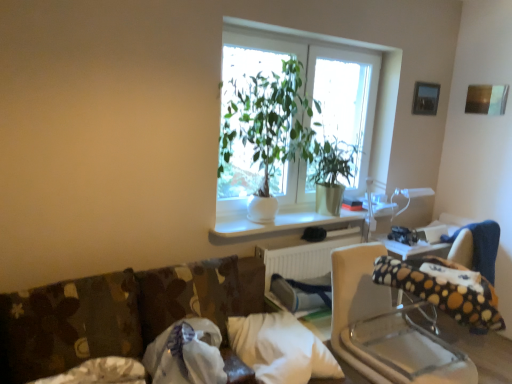
Describe the element at coordinates (444, 290) in the screenshot. I see `polka dot fabric bean bag chair at right` at that location.

Describe the element at coordinates (279, 222) in the screenshot. I see `white matte window sill at center` at that location.

Locate an element on the screen. white soft pillow at lower center, the 3th pillow viewed from the left is located at coordinates (280, 349).

The image size is (512, 384). Describe the element at coordinates (186, 354) in the screenshot. I see `white fabric pillow at lower left, which is the 2th pillow in left-to-right order` at that location.

What do you see at coordinates (385, 328) in the screenshot? I see `polka dot fabric rocking chair at center` at bounding box center [385, 328].

This screenshot has height=384, width=512. I want to click on polka dot fabric bean bag chair at right, so click(444, 290).

Between white fabric pillow at lower left, the second pillow when ordered from right to left, and metallic silver picture frame at upper right, which one appears on the right side from the viewer's perspective?

metallic silver picture frame at upper right is more to the right.

Does white fabric pillow at lower left, which is the 2th pillow in left-to-right order, have a lesser height compared to metallic silver picture frame at upper right?

Yes, white fabric pillow at lower left, which is the 2th pillow in left-to-right order, is shorter than metallic silver picture frame at upper right.

Which pillow is the 2nd one when counting from the left side of the metallic silver picture frame at upper right? Please provide its 2D coordinates.

[(186, 354)]

Is white fabric pillow at lower left, the second pillow when ordered from right to left, positioned with its back to metallic silver picture frame at upper right?

No, white fabric pillow at lower left, the second pillow when ordered from right to left,'s orientation is not away from metallic silver picture frame at upper right.

Considering the relative sizes of white matte window sill at center and polka dot fabric bean bag chair at right in the image provided, is white matte window sill at center wider than polka dot fabric bean bag chair at right?

No.

The width and height of the screenshot is (512, 384). I want to click on bean bag chair that is in front of the white matte window sill at center, so click(x=444, y=290).

From a real-world perspective, is white matte window sill at center positioned over polka dot fabric bean bag chair at right based on gravity?

Yes.

Is point (315, 215) closer or farther from the camera than point (424, 291)?

Point (315, 215) is positioned farther from the camera compared to point (424, 291).

Is white matte radiator at center oriented away from white soft pillow at lower center, the 3th pillow viewed from the left?

No.

Considering the sizes of objects white matte radiator at center and white soft pillow at lower center, the 3th pillow viewed from the left, in the image provided, who is thinner, white matte radiator at center or white soft pillow at lower center, the 3th pillow viewed from the left,?

With smaller width is white matte radiator at center.

Looking at the image, does white matte radiator at center seem bigger or smaller compared to white soft pillow at lower center, which appears as the 1th pillow when viewed from the right?

In the image, white matte radiator at center appears to be larger than white soft pillow at lower center, which appears as the 1th pillow when viewed from the right.

Find the location of a particular element. This screenshot has height=384, width=512. radiator lying above the white soft pillow at lower center, which appears as the 1th pillow when viewed from the right (from the image's perspective) is located at coordinates (302, 267).

Based on the photo, is polka dot fabric rocking chair at center positioned before white fabric pillow at lower left, the second pillow when ordered from right to left?

No.

Considering the relative sizes of polka dot fabric rocking chair at center and white fabric pillow at lower left, which is the 2th pillow in left-to-right order, in the image provided, is polka dot fabric rocking chair at center taller than white fabric pillow at lower left, which is the 2th pillow in left-to-right order,?

Yes.

At what (x,y) coordinates should I click in order to perform the action: click on rocking chair above the white fabric pillow at lower left, which is the 2th pillow in left-to-right order (from a real-world perspective). Please return your answer as a coordinate pair (x, y). The width and height of the screenshot is (512, 384). Looking at the image, I should click on (385, 328).

Who is taller, brown floral fabric pillow at lower left, placed as the 3th pillow when sorted from right to left, or polka dot fabric bean bag chair at right?

brown floral fabric pillow at lower left, placed as the 3th pillow when sorted from right to left, is taller.

From a real-world perspective, is brown floral fabric pillow at lower left, arranged as the first pillow when viewed from the left, above or below polka dot fabric bean bag chair at right?

brown floral fabric pillow at lower left, arranged as the first pillow when viewed from the left, is below polka dot fabric bean bag chair at right.

Does point (9, 317) lie behind point (477, 281)?

No.

Measure the distance between brown floral fabric pillow at lower left, arranged as the first pillow when viewed from the left, and polka dot fabric bean bag chair at right.

A distance of 1.30 meters exists between brown floral fabric pillow at lower left, arranged as the first pillow when viewed from the left, and polka dot fabric bean bag chair at right.

Considering their positions, is green glossy plant at center located in front of or behind metallic silver picture frame at upper right?

green glossy plant at center is in front of metallic silver picture frame at upper right.

Is green glossy plant at center completely or partially outside of metallic silver picture frame at upper right?

Indeed, green glossy plant at center is completely outside metallic silver picture frame at upper right.

Could you tell me if green glossy plant at center is turned towards metallic silver picture frame at upper right?

No, green glossy plant at center is not oriented towards metallic silver picture frame at upper right.

Looking at the image, does green glossy plant at center seem bigger or smaller compared to metallic silver picture frame at upper right?

In the image, green glossy plant at center appears to be larger than metallic silver picture frame at upper right.

I want to click on plant located behind the green glossy plant at center, so click(x=333, y=161).

In the scene shown: From a real-world perspective, who is located lower, green matte plant at center or green glossy plant at center?

green matte plant at center is physically lower.

Can you confirm if green matte plant at center is taller than green glossy plant at center?

No.

From the image's perspective, is green matte plant at center positioned above or below green glossy plant at center?

From the image's perspective, green matte plant at center appears below green glossy plant at center.

I want to click on picture frame above the white fabric pillow at lower left, the second pillow when ordered from right to left (from the image's perspective), so click(x=425, y=98).

In order to click on bean bag chair below the white matte window sill at center (from the image's perspective) in this screenshot , I will do `click(444, 290)`.

From the image, which object appears to be farther from brown floral fabric pillow at lower left, placed as the 3th pillow when sorted from right to left, polka dot fabric bean bag chair at right or white matte radiator at center?

Among the two, polka dot fabric bean bag chair at right is located further to brown floral fabric pillow at lower left, placed as the 3th pillow when sorted from right to left.

Considering their positions, is white soft pillow at lower center, which appears as the 1th pillow when viewed from the right, positioned closer to white matte radiator at center than polka dot fabric bean bag chair at right?

The object closer to white matte radiator at center is white soft pillow at lower center, which appears as the 1th pillow when viewed from the right.

When comparing their distances from brown floral fabric pillow at lower left, placed as the 3th pillow when sorted from right to left, does white soft pillow at lower center, which appears as the 1th pillow when viewed from the right, or polka dot fabric bean bag chair at right seem further?

The object further to brown floral fabric pillow at lower left, placed as the 3th pillow when sorted from right to left, is polka dot fabric bean bag chair at right.

Looking at this image, from the image, which object appears to be nearer to brown floral fabric pillow at lower left, arranged as the first pillow when viewed from the left, white matte window sill at center or white soft pillow at lower center, the 3th pillow viewed from the left?

Among the two, white soft pillow at lower center, the 3th pillow viewed from the left, is located nearer to brown floral fabric pillow at lower left, arranged as the first pillow when viewed from the left.

When comparing their distances from brown floral fabric pillow at lower left, arranged as the first pillow when viewed from the left, does green glossy plant at center or polka dot fabric bean bag chair at right seem further?

Based on the image, polka dot fabric bean bag chair at right appears to be further to brown floral fabric pillow at lower left, arranged as the first pillow when viewed from the left.

Which object lies further to the anchor point polka dot fabric bean bag chair at right, white matte window sill at center or metallic silver picture frame at upper right?

Among the two, metallic silver picture frame at upper right is located further to polka dot fabric bean bag chair at right.

Based on their spatial positions, is green glossy plant at center or white matte radiator at center further from polka dot fabric bean bag chair at right?

green glossy plant at center.

Based on their spatial positions, is white fabric pillow at lower left, which is the 2th pillow in left-to-right order, or white soft pillow at lower center, the 3th pillow viewed from the left, further from polka dot fabric bean bag chair at right?

white fabric pillow at lower left, which is the 2th pillow in left-to-right order.

The width and height of the screenshot is (512, 384). What are the coordinates of `houseplant between white fabric pillow at lower left, which is the 2th pillow in left-to-right order, and metallic silver picture frame at upper right` in the screenshot? It's located at (277, 132).

Identify the location of radiator situated between brown floral fabric pillow at lower left, arranged as the first pillow when viewed from the left, and polka dot fabric bean bag chair at right from left to right. (302, 267).

This screenshot has height=384, width=512. Find the location of `pillow between polka dot fabric rocking chair at center and white matte radiator at center in the front-back direction`. pillow between polka dot fabric rocking chair at center and white matte radiator at center in the front-back direction is located at coordinates (280, 349).

Where is `radiator between metallic silver picture frame at upper right and white soft pillow at lower center, the 3th pillow viewed from the left, in the vertical direction`? This screenshot has width=512, height=384. radiator between metallic silver picture frame at upper right and white soft pillow at lower center, the 3th pillow viewed from the left, in the vertical direction is located at coordinates (302, 267).